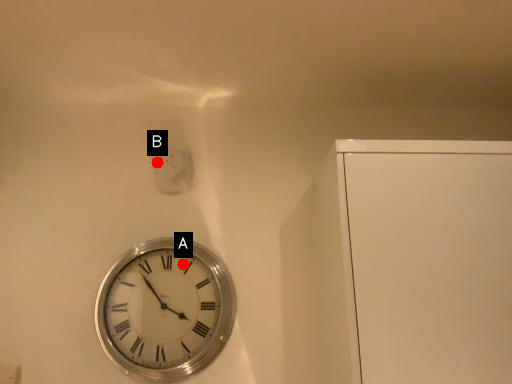
Question: Two points are circled on the image, labeled by A and B beside each circle. Among these points, which one is farthest from the camera?

Choices:
 (A) A is further
 (B) B is further

Answer: (B)